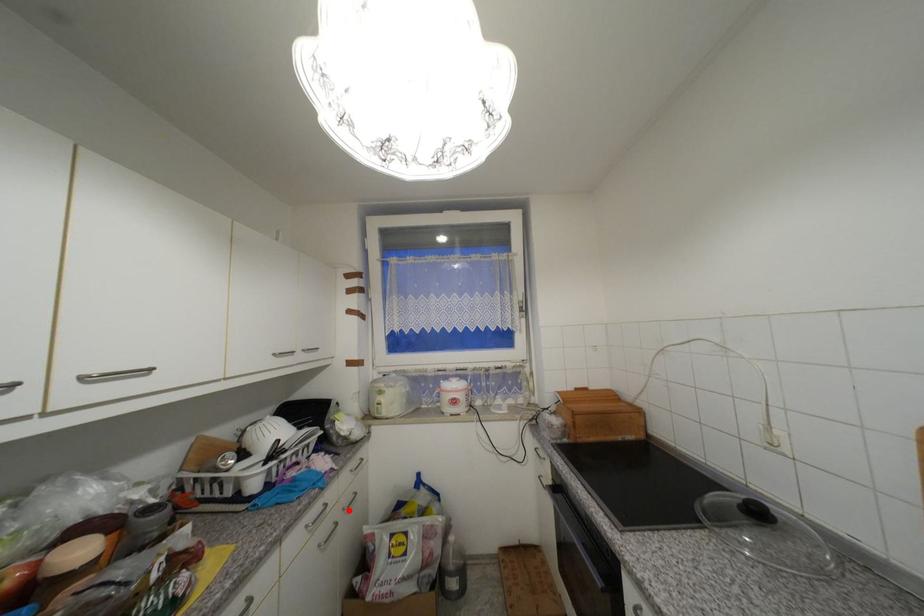
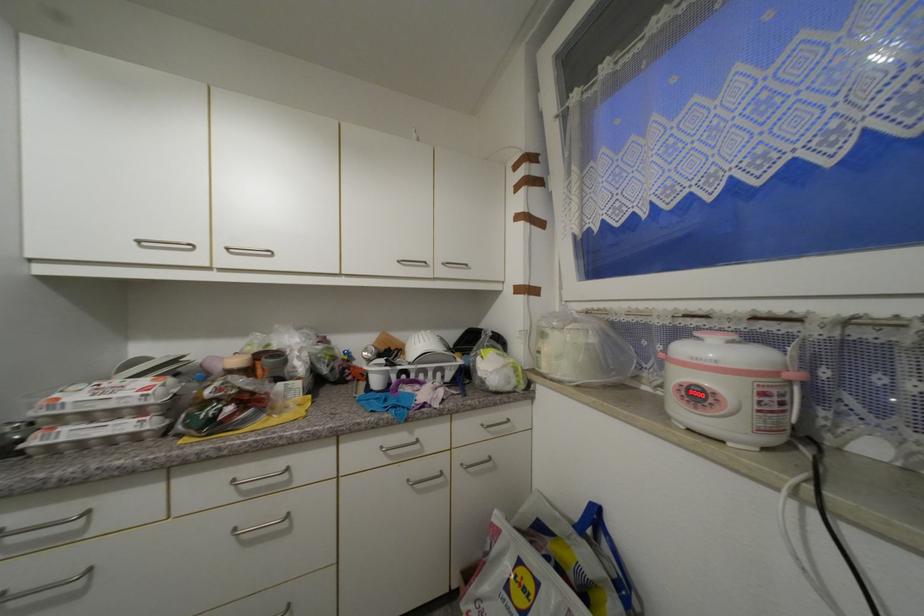
In the second image, find the point that corresponds to the highlighted location in the first image.

(468, 467)